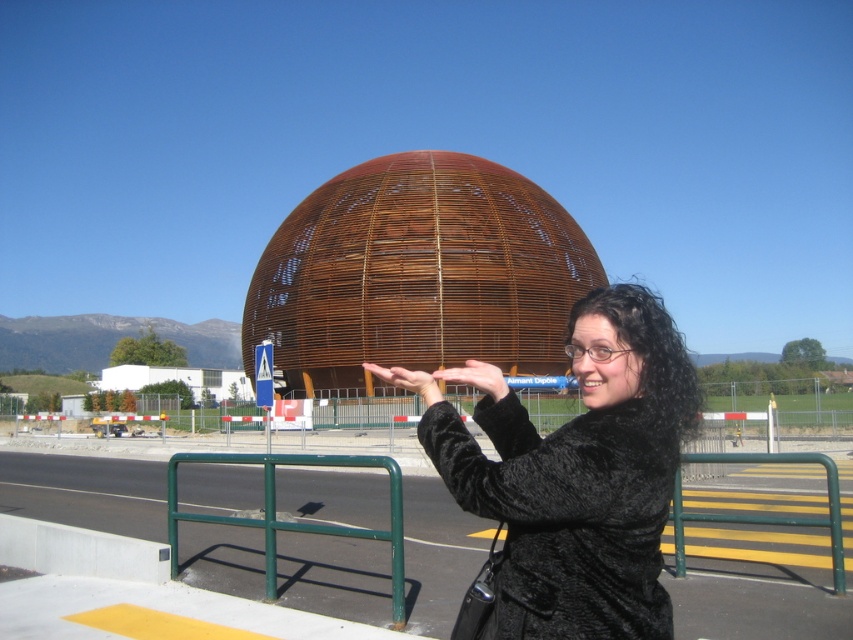
You are a contractor assessing the site. The rustic wood dome at center needs to be moved closer to the black fur coat at center. Considering their sizes, will the dome completely block the view of the coat when positioned directly in front of it?

The rustic wood dome at center is larger in size compared to the black fur coat at center. When positioned directly in front, the dome will completely block the view of the coat.

You are a visitor at this location and want to take a photo of the rustic wood dome at center and the black fur coat at center. Where should you position yourself to capture both in the frame?

To capture both the rustic wood dome at center and the black fur coat at center in the same frame, position yourself to the right of the black fur coat at center so that the rustic wood dome at center is visible to the left of it.

Looking at this image, you are a contractor assessing the site. The rustic wood dome at center needs to be lowered by 2 meters to meet safety regulations. Can the black fur coat at center still be worn by someone standing upright underneath it after adjustment?

The rustic wood dome at center has a greater height compared to the black fur coat at center. After lowering it by 2 meters, the dome will still be taller than the coat, so yes, someone can stand upright underneath it while wearing the black fur coat at center.